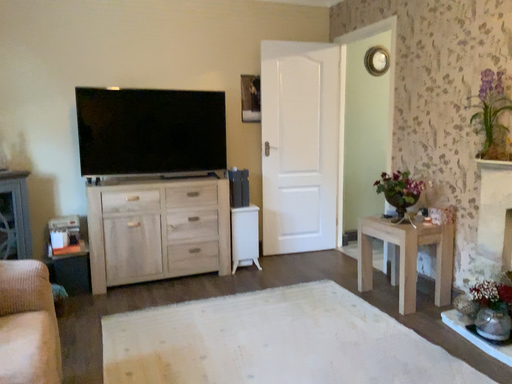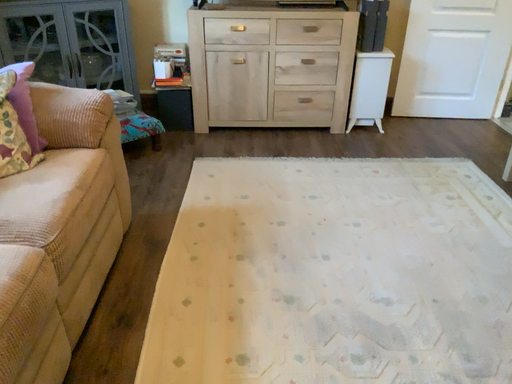
Question: How did the camera likely rotate when shooting the video?

Choices:
 (A) rotated upward
 (B) rotated downward

Answer: (B)